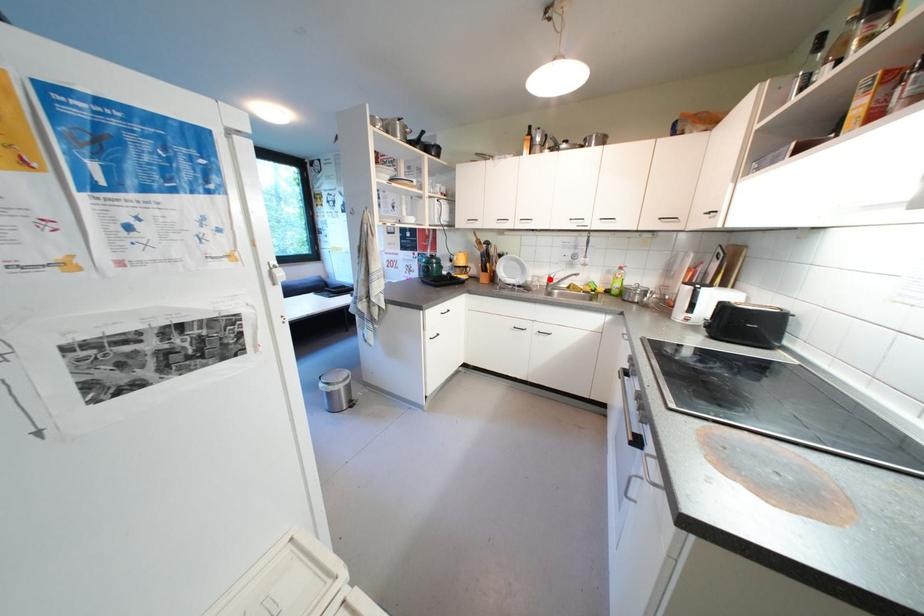
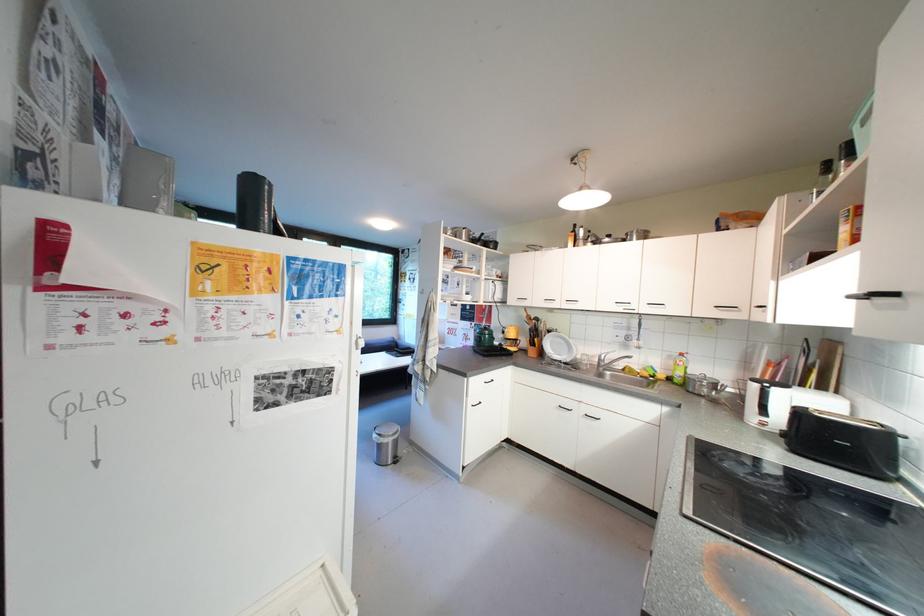
Find the pixel in the second image that matches the highlighted location in the first image.

(602, 359)